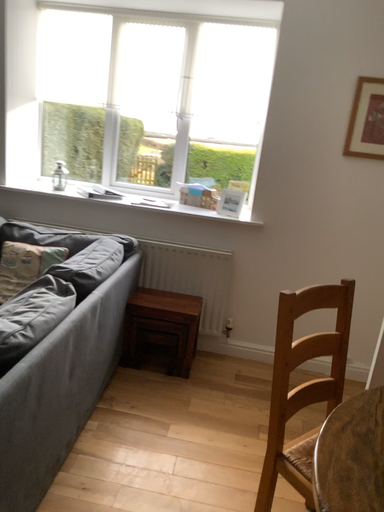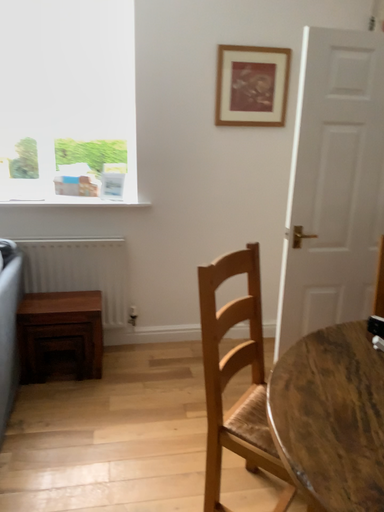
Question: Which way did the camera rotate in the video?

Choices:
 (A) rotated left
 (B) rotated right

Answer: (B)